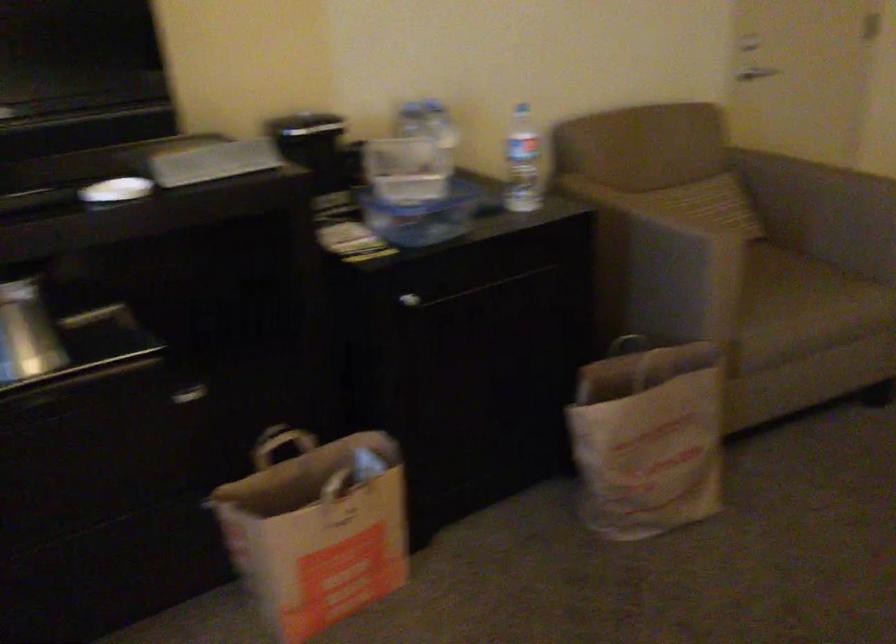
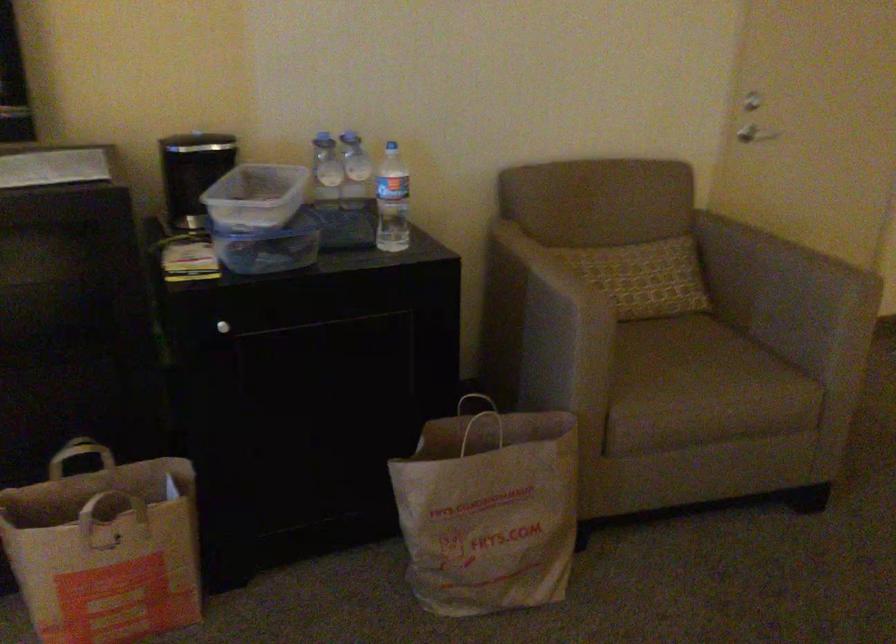
Question: Based on the continuous images, in which direction is the camera rotating? Reply with the corresponding letter.

Choices:
 (A) Left
 (B) Right
 (C) Up
 (D) Down

Answer: (A)